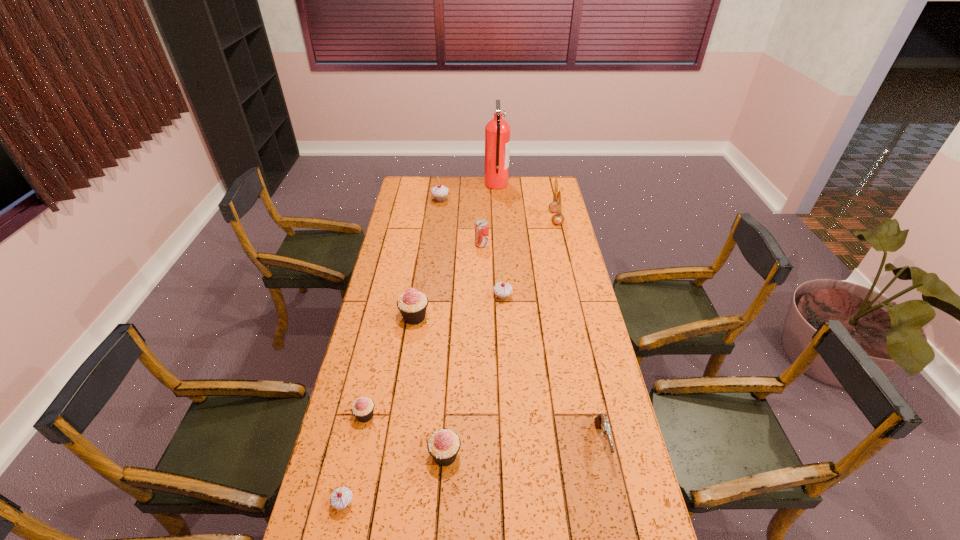
The image size is (960, 540). I want to click on vacant point located 0.110m at the barrel of the gray pistol, so tap(616, 506).

Locate an element on the screen. vacant space located on the right of the fourth farthest cupcake is located at coordinates tap(452, 415).

Where is `blank space located on the back of the smallest gray cupcake`? blank space located on the back of the smallest gray cupcake is located at coordinates (363, 415).

The image size is (960, 540). Identify the location of fire extinguisher located in the far edge section of the desktop. (497, 132).

Locate an element on the screen. Image resolution: width=960 pixels, height=540 pixels. cupcake located at the far edge is located at coordinates (439, 192).

Find the location of a particular element. This screenshot has width=960, height=540. earphone located in the right edge section of the desktop is located at coordinates (556, 206).

Where is `pistol situated at the right edge`? This screenshot has width=960, height=540. pistol situated at the right edge is located at coordinates (601, 422).

Where is `vacant space at the far edge of the desktop`? The image size is (960, 540). vacant space at the far edge of the desktop is located at coordinates (457, 189).

Where is `vacant area at the left edge of the desktop`? The height and width of the screenshot is (540, 960). vacant area at the left edge of the desktop is located at coordinates click(413, 228).

What are the coordinates of `free space at the right edge of the desktop` in the screenshot? It's located at (570, 369).